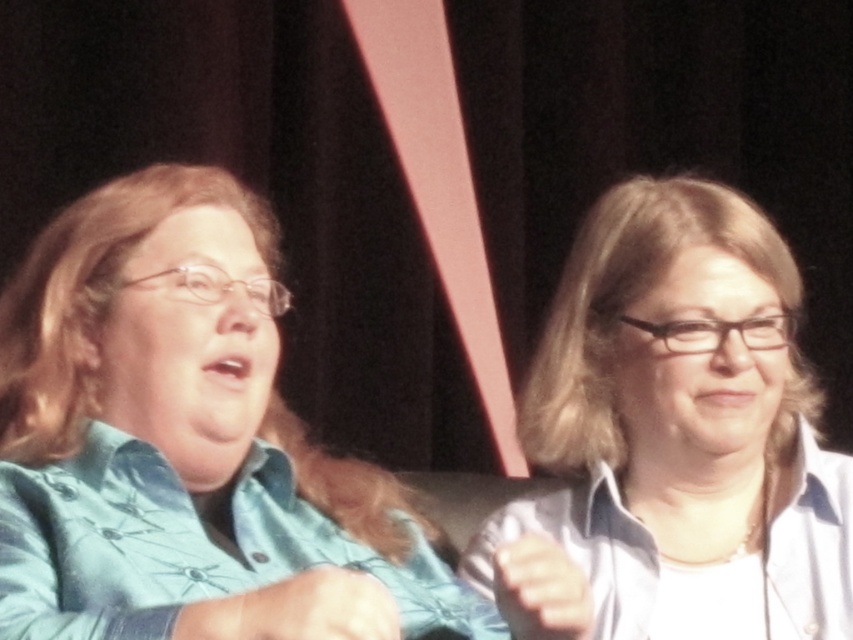
Is point (189, 538) less distant than point (663, 614)?

That is True.

Can you confirm if teal fabric shirt at left is positioned to the left of white glossy shirt at upper right?

Indeed, teal fabric shirt at left is positioned on the left side of white glossy shirt at upper right.

Describe the element at coordinates (184, 444) in the screenshot. I see `teal fabric shirt at left` at that location.

Locate an element on the screen. The height and width of the screenshot is (640, 853). teal fabric shirt at left is located at coordinates (184, 444).